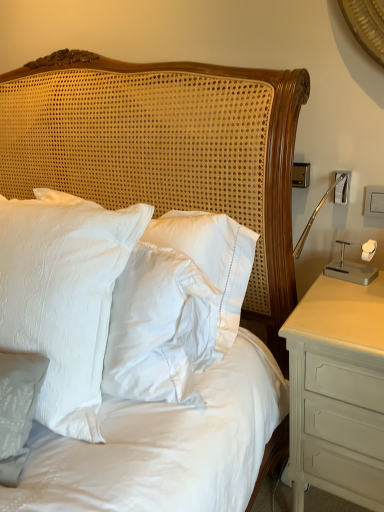
Question: Does white satin pillows at center have a greater height compared to white satin pillow at center?

Choices:
 (A) yes
 (B) no

Answer: (A)

Question: Considering the relative sizes of white satin pillows at center and white satin pillow at center in the image provided, is white satin pillows at center smaller than white satin pillow at center?

Choices:
 (A) no
 (B) yes

Answer: (A)

Question: Can you confirm if white satin pillows at center is thinner than white satin pillow at center?

Choices:
 (A) yes
 (B) no

Answer: (A)

Question: Is white satin pillows at center facing away from white satin pillow at center?

Choices:
 (A) no
 (B) yes

Answer: (B)

Question: From a real-world perspective, is white satin pillows at center under white satin pillow at center?

Choices:
 (A) yes
 (B) no

Answer: (A)

Question: Is white painted wood nightstand at right in front of or behind white satin pillows at center in the image?

Choices:
 (A) behind
 (B) front

Answer: (A)

Question: From their relative heights in the image, would you say white painted wood nightstand at right is taller or shorter than white satin pillows at center?

Choices:
 (A) tall
 (B) short

Answer: (B)

Question: Is white painted wood nightstand at right bigger or smaller than white satin pillows at center?

Choices:
 (A) small
 (B) big

Answer: (A)

Question: Looking at their shapes, would you say white painted wood nightstand at right is wider or thinner than white satin pillows at center?

Choices:
 (A) wide
 (B) thin

Answer: (A)

Question: From their relative heights in the image, would you say white satin pillows at center is taller or shorter than white painted wood nightstand at right?

Choices:
 (A) short
 (B) tall

Answer: (B)

Question: Is white satin pillows at center situated inside white painted wood nightstand at right or outside?

Choices:
 (A) outside
 (B) inside

Answer: (A)

Question: Looking at the image, does white satin pillows at center seem bigger or smaller compared to white painted wood nightstand at right?

Choices:
 (A) small
 (B) big

Answer: (B)

Question: From the image's perspective, is white satin pillows at center positioned above or below white painted wood nightstand at right?

Choices:
 (A) below
 (B) above

Answer: (B)

Question: Looking at the image, does white satin pillow at center seem bigger or smaller compared to white satin pillows at center?

Choices:
 (A) small
 (B) big

Answer: (A)

Question: Would you say white satin pillow at center is inside or outside white satin pillows at center?

Choices:
 (A) outside
 (B) inside

Answer: (A)